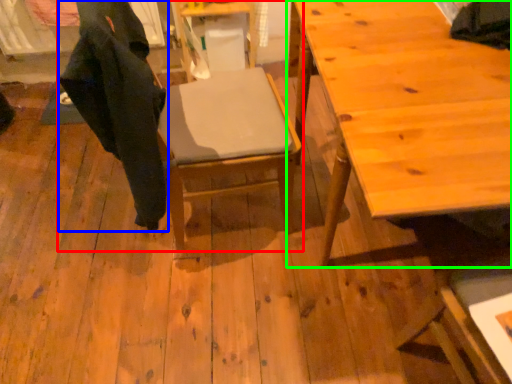
Question: Which object is the closest to the chair (highlighted by a red box)? Choose among these: robe (highlighted by a blue box) or table (highlighted by a green box).

Choices:
 (A) robe
 (B) table

Answer: (A)